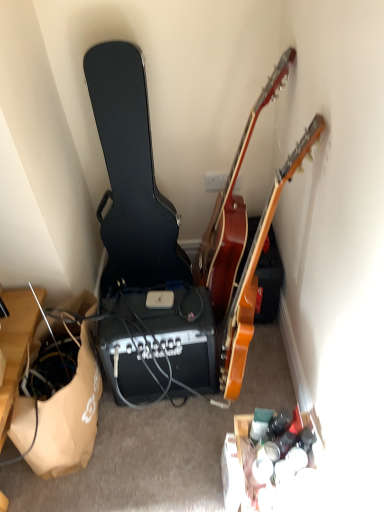
Question: Can you confirm if brown paper bag at lower left is smaller than wooden acoustic guitar at upper right, the third guitar viewed from the left?

Choices:
 (A) no
 (B) yes

Answer: (B)

Question: Considering the relative positions of brown paper bag at lower left and wooden acoustic guitar at upper right, which ranks as the 1th guitar in right-to-left order, in the image provided, is brown paper bag at lower left to the left of wooden acoustic guitar at upper right, which ranks as the 1th guitar in right-to-left order, from the viewer's perspective?

Choices:
 (A) yes
 (B) no

Answer: (A)

Question: Can wooden acoustic guitar at upper right, which ranks as the 1th guitar in right-to-left order, be found inside brown paper bag at lower left?

Choices:
 (A) yes
 (B) no

Answer: (B)

Question: Is the position of brown paper bag at lower left more distant than that of wooden acoustic guitar at upper right, the third guitar viewed from the left?

Choices:
 (A) yes
 (B) no

Answer: (A)

Question: Are brown paper bag at lower left and wooden acoustic guitar at upper right, which ranks as the 1th guitar in right-to-left order, located far from each other?

Choices:
 (A) yes
 (B) no

Answer: (B)

Question: Is brown paper bag at lower left to the right of wooden acoustic guitar at upper right, which ranks as the 1th guitar in right-to-left order, from the viewer's perspective?

Choices:
 (A) yes
 (B) no

Answer: (B)

Question: Can you confirm if black hard case at left, the 3th guitar viewed from the right, is thinner than wooden acoustic guitar at upper right, which ranks as the 1th guitar in right-to-left order?

Choices:
 (A) no
 (B) yes

Answer: (A)

Question: Is black hard case at left, the 3th guitar viewed from the right, taller than wooden acoustic guitar at upper right, the third guitar viewed from the left?

Choices:
 (A) no
 (B) yes

Answer: (B)

Question: Considering the relative positions of black hard case at left, the 3th guitar viewed from the right, and wooden acoustic guitar at upper right, the third guitar viewed from the left, in the image provided, is black hard case at left, the 3th guitar viewed from the right, to the left of wooden acoustic guitar at upper right, the third guitar viewed from the left, from the viewer's perspective?

Choices:
 (A) no
 (B) yes

Answer: (B)

Question: Is black hard case at left, the 3th guitar viewed from the right, looking in the opposite direction of wooden acoustic guitar at upper right, the third guitar viewed from the left?

Choices:
 (A) yes
 (B) no

Answer: (B)

Question: Does black hard case at left, the 3th guitar viewed from the right, appear on the right side of wooden acoustic guitar at upper right, the third guitar viewed from the left?

Choices:
 (A) yes
 (B) no

Answer: (B)

Question: From a real-world perspective, is black hard case at left, which is the first guitar in left-to-right order, under wooden acoustic guitar at upper right, the third guitar viewed from the left?

Choices:
 (A) yes
 (B) no

Answer: (B)

Question: Can you confirm if glossy wood guitar at upper right, acting as the second guitar starting from the right, is thinner than brown paper bag at lower left?

Choices:
 (A) yes
 (B) no

Answer: (B)